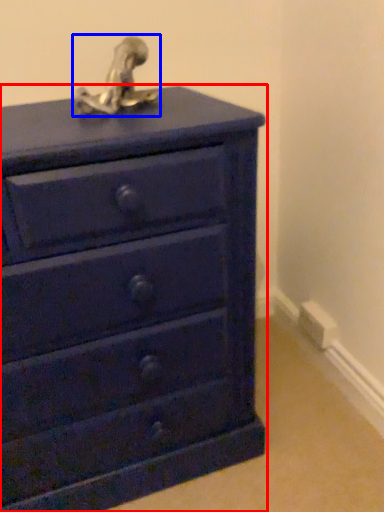
Question: Among these objects, which one is nearest to the camera, chest of drawers (highlighted by a red box) or sculpture (highlighted by a blue box)?

Choices:
 (A) chest of drawers
 (B) sculpture

Answer: (A)